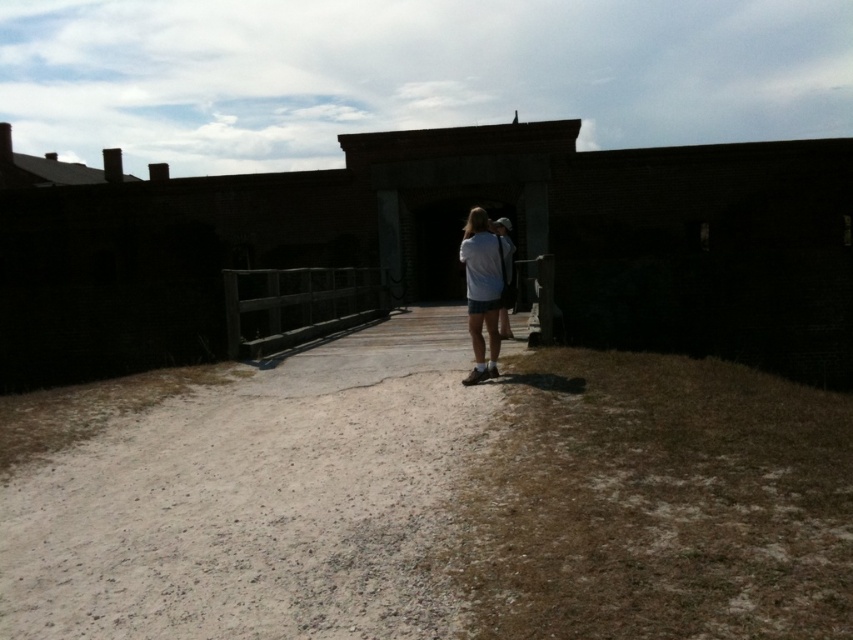
You are standing at the entrance of the dark brick structure and want to move towards the point labeled as point (x=38, y=221). Which direction should you walk relative to the point labeled as point (x=503, y=280)?

To reach point (x=38, y=221) from the entrance, you should walk behind the point (x=503, y=280) since point (x=38, y=221) is located behind point (x=503, y=280).

You are standing at the entrance of the dark brick structure and want to walk along the path to the parking lot. The parking lot is located behind the white cotton shirt at center. Can you walk directly from the brown gravel path at center to the parking lot without stepping off the path?

The brown gravel path at center is located below white cotton shirt at center, so the parking lot behind the white cotton shirt at center would be accessible via the path. Therefore, you can walk directly from the brown gravel path at center to the parking lot without stepping off the path.